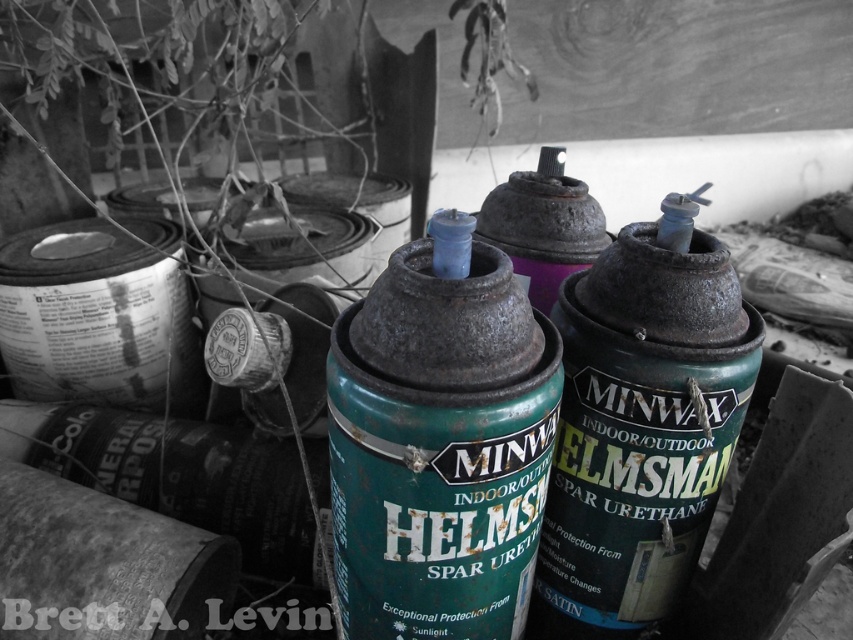
You are an organizer trying to arrange items on a shelf. You have a rusty green paint can at center and a green matte spray can at center. If you want to place them side by side horizontally, which one should you place first to ensure they fit properly?

The rusty green paint can at center has a lesser width compared to the green matte spray can at center, so you should place the green matte spray can at center first to accommodate its larger width.

Based on the scene description, where is the rusty green paint can at center located in terms of its 2D coordinates?

The rusty green paint can at center is located at the 2D coordinates point (x=439, y=448).